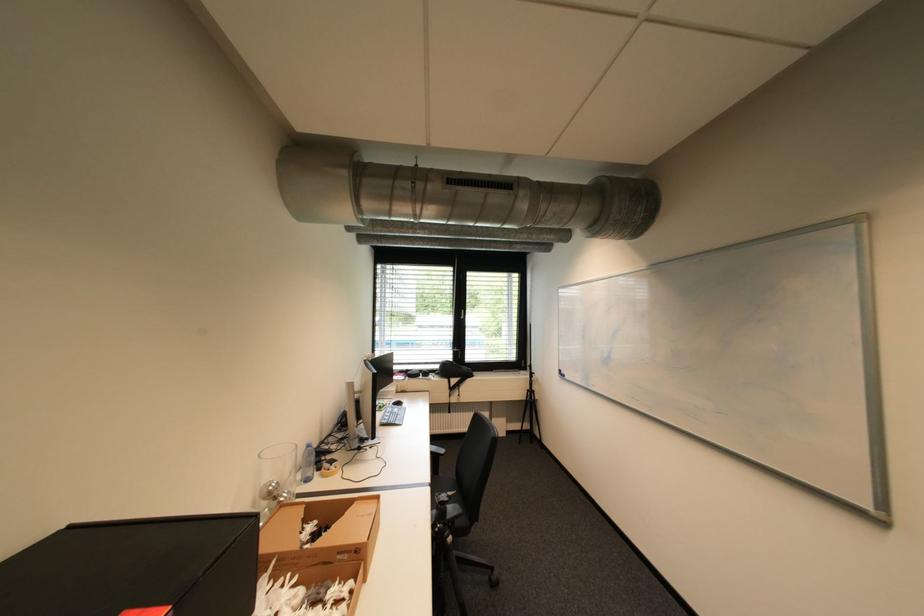
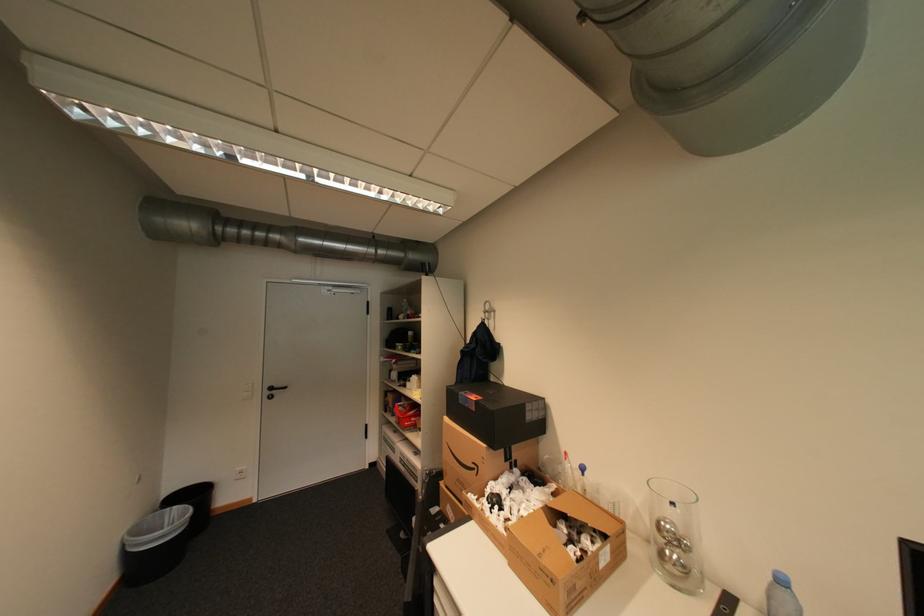
The point at (x=282, y=487) is marked in the first image. Where is the corresponding point in the second image?

(673, 527)